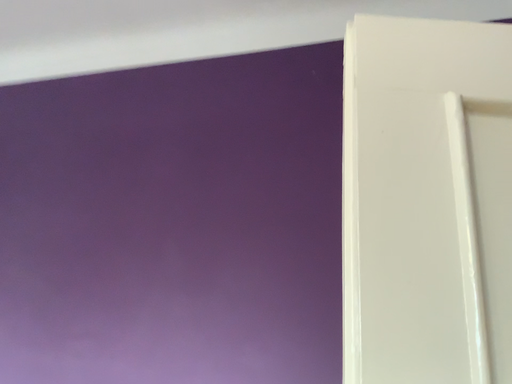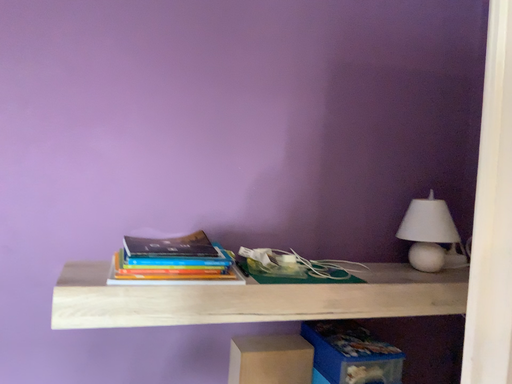
Question: How did the camera likely rotate when shooting the video?

Choices:
 (A) rotated downward
 (B) rotated upward

Answer: (A)